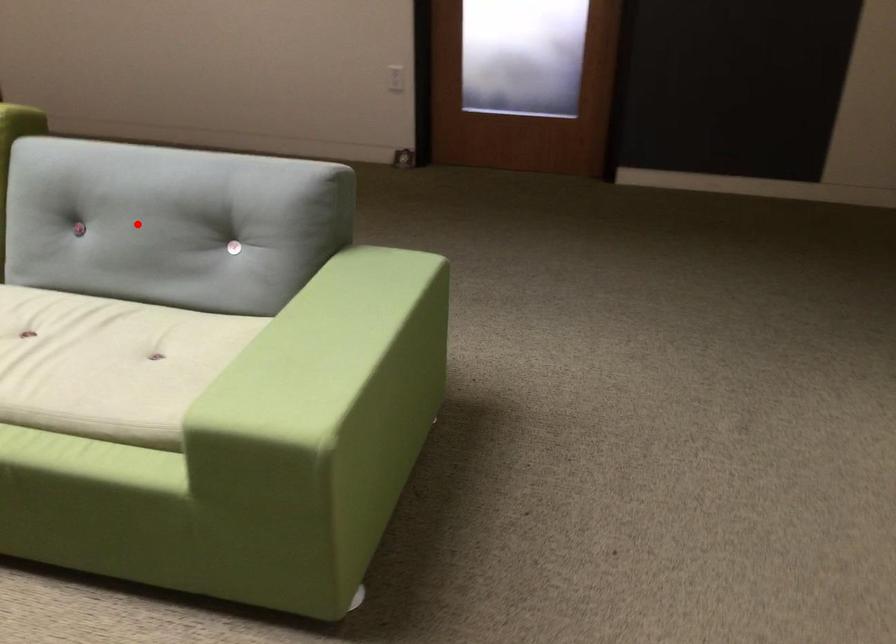
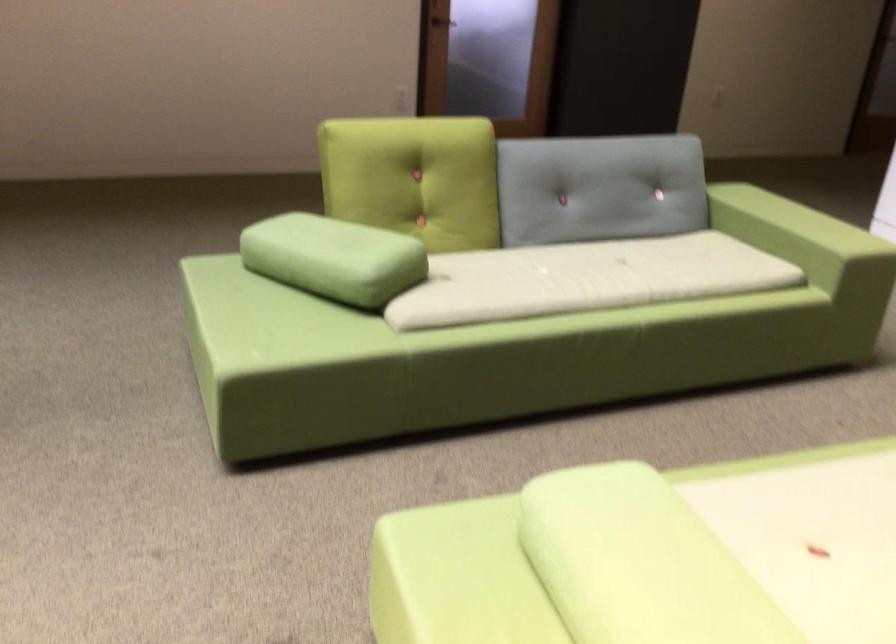
Question: I am providing you with two images of the same scene from different viewpoints. A red point is shown in image1. For the corresponding object point in image2, is it positioned nearer or farther from the camera?

Choices:
 (A) Nearer
 (B) Farther

Answer: (B)